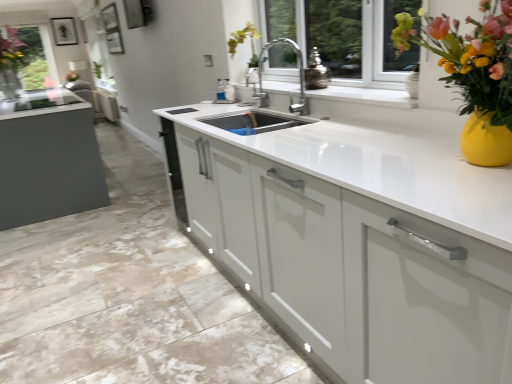
Question: Is transparent glass window at upper left in front of white glossy cabinet at center, the second cabinetry viewed from the top?

Choices:
 (A) yes
 (B) no

Answer: (B)

Question: Considering the relative sizes of transparent glass window at upper left and white glossy cabinet at center, the second cabinetry viewed from the top, in the image provided, is transparent glass window at upper left thinner than white glossy cabinet at center, the second cabinetry viewed from the top,?

Choices:
 (A) no
 (B) yes

Answer: (B)

Question: Can you confirm if transparent glass window at upper left is shorter than white glossy cabinet at center, marked as the first cabinetry in a front-to-back arrangement?

Choices:
 (A) yes
 (B) no

Answer: (B)

Question: Is transparent glass window at upper left next to white glossy cabinet at center, marked as the first cabinetry in a front-to-back arrangement, and touching it?

Choices:
 (A) yes
 (B) no

Answer: (B)

Question: Is transparent glass window at upper left at the left side of white glossy cabinet at center, the second cabinetry viewed from the top?

Choices:
 (A) no
 (B) yes

Answer: (B)

Question: From a real-world perspective, is white glossy cabinet at center, the first cabinetry viewed from the back, positioned above or below white glossy cabinet at center, positioned as the first cabinetry in bottom-to-top order?

Choices:
 (A) below
 (B) above

Answer: (B)

Question: In terms of width, does white glossy cabinet at center, arranged as the 2th cabinetry when viewed from the front, look wider or thinner when compared to white glossy cabinet at center, positioned as the first cabinetry in bottom-to-top order?

Choices:
 (A) thin
 (B) wide

Answer: (A)

Question: From the image's perspective, is white glossy cabinet at center, which is the second cabinetry from bottom to top, positioned above or below white glossy cabinet at center, marked as the first cabinetry in a front-to-back arrangement?

Choices:
 (A) below
 (B) above

Answer: (B)

Question: Considering the positions of white glossy cabinet at center, which is the second cabinetry from bottom to top, and white glossy cabinet at center, marked as the first cabinetry in a front-to-back arrangement, in the image, is white glossy cabinet at center, which is the second cabinetry from bottom to top, taller or shorter than white glossy cabinet at center, marked as the first cabinetry in a front-to-back arrangement,?

Choices:
 (A) short
 (B) tall

Answer: (B)

Question: Considering the positions of point (23, 54) and point (455, 332), is point (23, 54) closer or farther from the camera than point (455, 332)?

Choices:
 (A) farther
 (B) closer

Answer: (A)

Question: From a real-world perspective, is transparent glass window at upper left physically located above or below white glossy cabinet at center, marked as the first cabinetry in a front-to-back arrangement?

Choices:
 (A) above
 (B) below

Answer: (A)

Question: Relative to white glossy cabinet at center, the 2th cabinetry from the back, is transparent glass window at upper left in front or behind?

Choices:
 (A) behind
 (B) front

Answer: (A)

Question: Which is correct: transparent glass window at upper left is inside white glossy cabinet at center, the second cabinetry viewed from the top, or outside of it?

Choices:
 (A) inside
 (B) outside

Answer: (B)

Question: From a real-world perspective, relative to white glossy cabinet at center, the second cabinetry viewed from the top, is vibrant ceramic vase at upper right vertically above or below?

Choices:
 (A) above
 (B) below

Answer: (A)

Question: Considering the positions of vibrant ceramic vase at upper right and white glossy cabinet at center, the second cabinetry viewed from the top, in the image, is vibrant ceramic vase at upper right wider or thinner than white glossy cabinet at center, the second cabinetry viewed from the top,?

Choices:
 (A) wide
 (B) thin

Answer: (B)